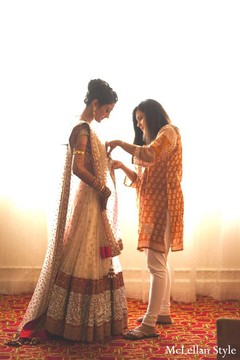
Identify the location of white curtain. The height and width of the screenshot is (360, 240). (216, 74).